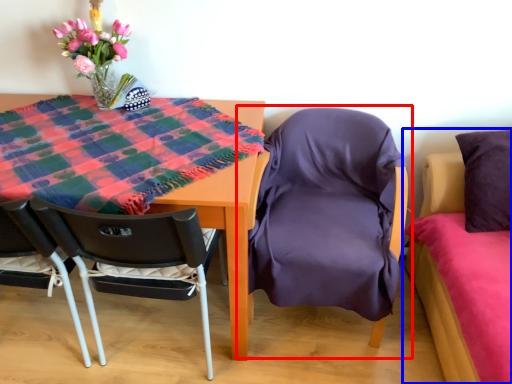
Question: Which object is closer to the camera taking this photo, chair (highlighted by a red box) or bed (highlighted by a blue box)?

Choices:
 (A) chair
 (B) bed

Answer: (B)